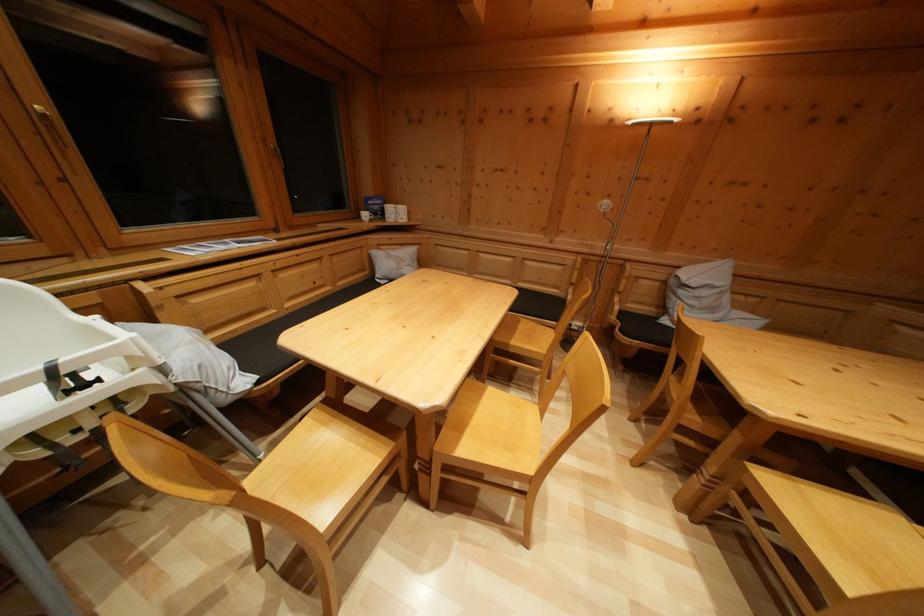
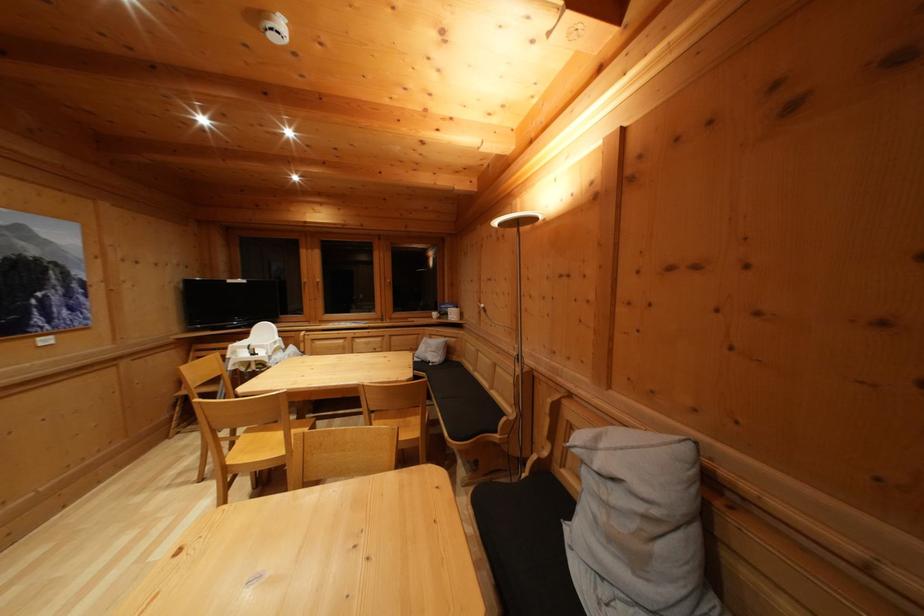
The point at (377, 206) is marked in the first image. Where is the corresponding point in the second image?

(450, 310)